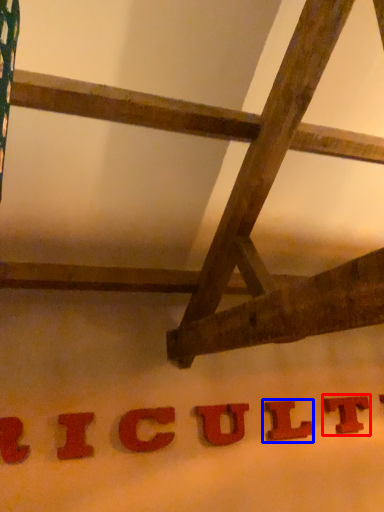
Question: Which object is closer to the camera taking this photo, letter (highlighted by a red box) or letter (highlighted by a blue box)?

Choices:
 (A) letter
 (B) letter

Answer: (B)